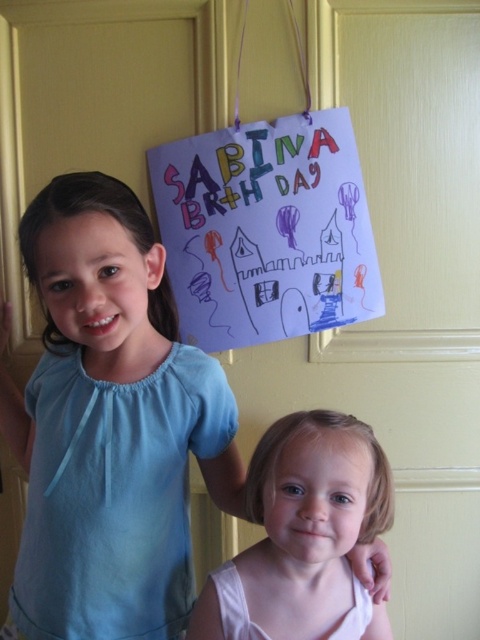
Consider the image. Between blue fabric shirt at upper left and smooth white shirt at lower center, which one has less height?

smooth white shirt at lower center is shorter.

Does blue fabric shirt at upper left have a greater width compared to smooth white shirt at lower center?

Indeed, blue fabric shirt at upper left has a greater width compared to smooth white shirt at lower center.

Describe the element at coordinates (109, 424) in the screenshot. The image size is (480, 640). I see `blue fabric shirt at upper left` at that location.

The height and width of the screenshot is (640, 480). I want to click on blue fabric shirt at upper left, so click(109, 424).

Which is in front, point (291, 288) or point (290, 451)?

Point (290, 451) is in front.

Is the position of purple paper sign at upper center more distant than that of smooth white shirt at lower center?

Yes.

Who is more distant from viewer, (193,342) or (253,627)?

The point (193,342) is more distant.

This screenshot has width=480, height=640. I want to click on purple paper sign at upper center, so click(265, 230).

Is point (39, 582) farther from viewer compared to point (372, 257)?

That is False.

Identify the location of blue fabric shirt at upper left. (109, 424).

Find the location of `blue fabric shirt at upper left`. blue fabric shirt at upper left is located at coordinates (109, 424).

I want to click on blue fabric shirt at upper left, so click(x=109, y=424).